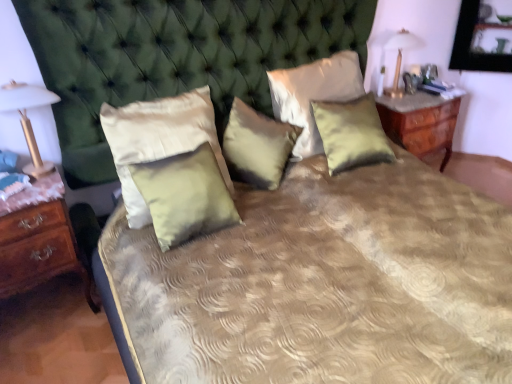
Question: From the image's perspective, does satin yellow pillow at center, the first pillow positioned from the right, appear higher than satin/velvet pillow at center, the 1th pillow when ordered from left to right?

Choices:
 (A) no
 (B) yes

Answer: (B)

Question: Can you confirm if satin yellow pillow at center, which appears as the 5th pillow when viewed from the left, is taller than satin/velvet pillow at center, which ranks as the 5th pillow in right-to-left order?

Choices:
 (A) no
 (B) yes

Answer: (A)

Question: Are satin yellow pillow at center, which appears as the 5th pillow when viewed from the left, and satin/velvet pillow at center, which ranks as the 5th pillow in right-to-left order, far apart?

Choices:
 (A) yes
 (B) no

Answer: (B)

Question: From a real-world perspective, is satin yellow pillow at center, the first pillow positioned from the right, under satin/velvet pillow at center, the 1th pillow when ordered from left to right?

Choices:
 (A) yes
 (B) no

Answer: (A)

Question: Would you say satin yellow pillow at center, which appears as the 5th pillow when viewed from the left, contains satin/velvet pillow at center, the 1th pillow when ordered from left to right?

Choices:
 (A) no
 (B) yes

Answer: (A)

Question: Can you confirm if satin yellow pillow at center, which appears as the 5th pillow when viewed from the left, is wider than satin/velvet pillow at center, the 1th pillow when ordered from left to right?

Choices:
 (A) no
 (B) yes

Answer: (A)

Question: Can you confirm if gold metallic lampshade at left, the second bedside lamp when ordered from right to left, is positioned to the right of satin green pillow at center, which is counted as the second pillow, starting from the right?

Choices:
 (A) yes
 (B) no

Answer: (B)

Question: Can you confirm if gold metallic lampshade at left, which appears as the second bedside lamp when viewed from the back, is bigger than satin green pillow at center, placed as the 4th pillow when sorted from left to right?

Choices:
 (A) yes
 (B) no

Answer: (B)

Question: Would you consider gold metallic lampshade at left, acting as the 2th bedside lamp starting from the top, to be distant from satin green pillow at center, which is counted as the second pillow, starting from the right?

Choices:
 (A) yes
 (B) no

Answer: (A)

Question: Does gold metallic lampshade at left, acting as the 2th bedside lamp starting from the top, turn towards satin green pillow at center, placed as the 4th pillow when sorted from left to right?

Choices:
 (A) yes
 (B) no

Answer: (B)

Question: Can you see gold metallic lampshade at left, marked as the first bedside lamp in a bottom-to-top arrangement, touching satin green pillow at center, which is counted as the second pillow, starting from the right?

Choices:
 (A) no
 (B) yes

Answer: (A)

Question: Is gold metallic lampshade at left, arranged as the first bedside lamp when viewed from the front, closer to the viewer compared to satin green pillow at center, which is counted as the second pillow, starting from the right?

Choices:
 (A) yes
 (B) no

Answer: (A)

Question: Does satin green pillow at center, acting as the 4th pillow starting from the right, have a smaller size compared to gold metallic lampshade at left, arranged as the first bedside lamp when viewed from the front?

Choices:
 (A) yes
 (B) no

Answer: (B)